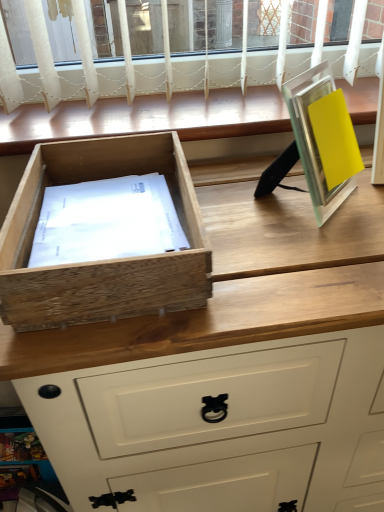
Question: Considering the relative positions of wooden window sill at upper center and metallic silver picture frame at right in the image provided, is wooden window sill at upper center in front of metallic silver picture frame at right?

Choices:
 (A) no
 (B) yes

Answer: (A)

Question: From a real-world perspective, does wooden window sill at upper center stand above metallic silver picture frame at right?

Choices:
 (A) no
 (B) yes

Answer: (A)

Question: From a real-world perspective, is wooden window sill at upper center physically below metallic silver picture frame at right?

Choices:
 (A) no
 (B) yes

Answer: (B)

Question: Is metallic silver picture frame at right completely or partially inside wooden window sill at upper center?

Choices:
 (A) yes
 (B) no

Answer: (B)

Question: Can you confirm if wooden window sill at upper center is taller than metallic silver picture frame at right?

Choices:
 (A) no
 (B) yes

Answer: (A)

Question: Is natural wood drawer at left inside or outside of wooden window sill at upper center?

Choices:
 (A) outside
 (B) inside

Answer: (A)

Question: From the image's perspective, is natural wood drawer at left located above or below wooden window sill at upper center?

Choices:
 (A) below
 (B) above

Answer: (A)

Question: Based on their positions, is natural wood drawer at left located to the left or right of wooden window sill at upper center?

Choices:
 (A) left
 (B) right

Answer: (A)

Question: In the image, is natural wood drawer at left positioned in front of or behind wooden window sill at upper center?

Choices:
 (A) behind
 (B) front

Answer: (B)

Question: Considering the relative positions of metallic silver picture frame at right and natural wood drawer at left in the image provided, is metallic silver picture frame at right to the left or to the right of natural wood drawer at left?

Choices:
 (A) left
 (B) right

Answer: (B)

Question: From a real-world perspective, is metallic silver picture frame at right physically located above or below natural wood drawer at left?

Choices:
 (A) above
 (B) below

Answer: (A)

Question: Looking at the image, does metallic silver picture frame at right seem bigger or smaller compared to natural wood drawer at left?

Choices:
 (A) big
 (B) small

Answer: (B)

Question: Is metallic silver picture frame at right in front of or behind natural wood drawer at left in the image?

Choices:
 (A) front
 (B) behind

Answer: (B)

Question: From the image's perspective, is metallic silver picture frame at right above or below wooden window sill at upper center?

Choices:
 (A) above
 (B) below

Answer: (B)

Question: Would you say metallic silver picture frame at right is to the left or to the right of wooden window sill at upper center in the picture?

Choices:
 (A) right
 (B) left

Answer: (A)